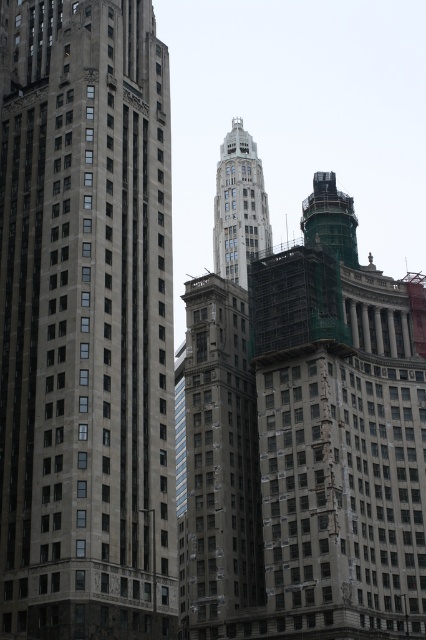
Question: Among these points, which one is nearest to the camera?

Choices:
 (A) (347, 259)
 (B) (238, 212)

Answer: (A)

Question: Which object is farther from the camera taking this photo?

Choices:
 (A) gray stone building at center
 (B) greenish concrete tower at center-right
 (C) gray stone tower at center

Answer: (C)

Question: Does gray stone building at center come behind greenish concrete tower at center-right?

Choices:
 (A) no
 (B) yes

Answer: (A)

Question: Which object is closer to the camera taking this photo?

Choices:
 (A) brown stone building at center
 (B) greenish concrete tower at center-right
 (C) gray stone tower at center

Answer: (A)

Question: Is brown stone building at center above gray stone tower at center?

Choices:
 (A) no
 (B) yes

Answer: (A)

Question: Is gray stone tower at center behind green glass tower at center?

Choices:
 (A) yes
 (B) no

Answer: (A)